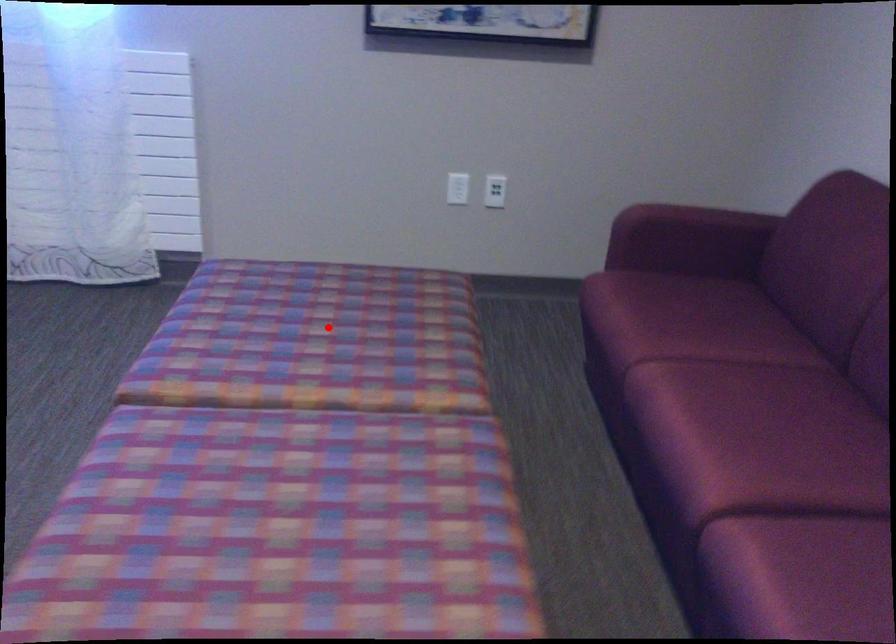
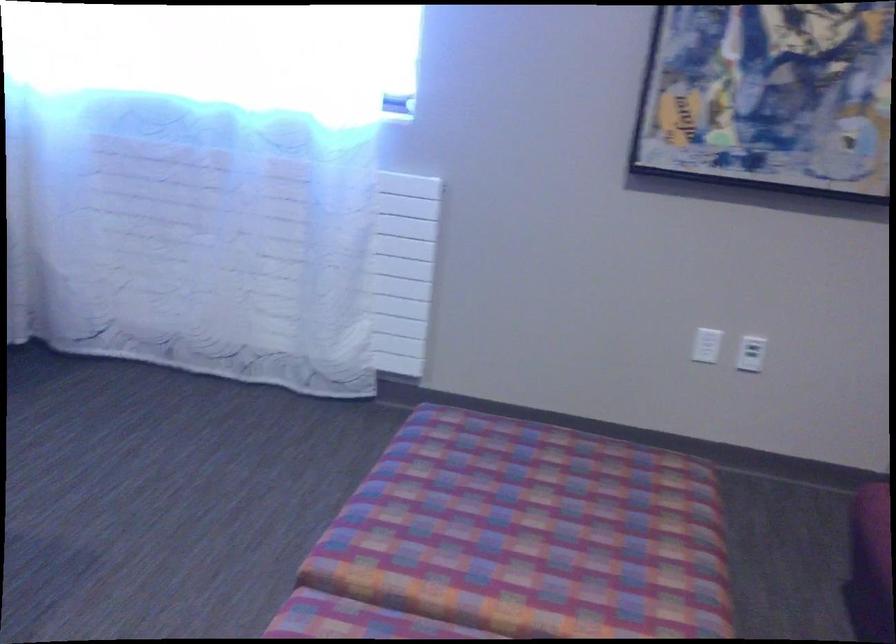
Where in the second image is the point corresponding to the highlighted location from the first image?

(550, 516)